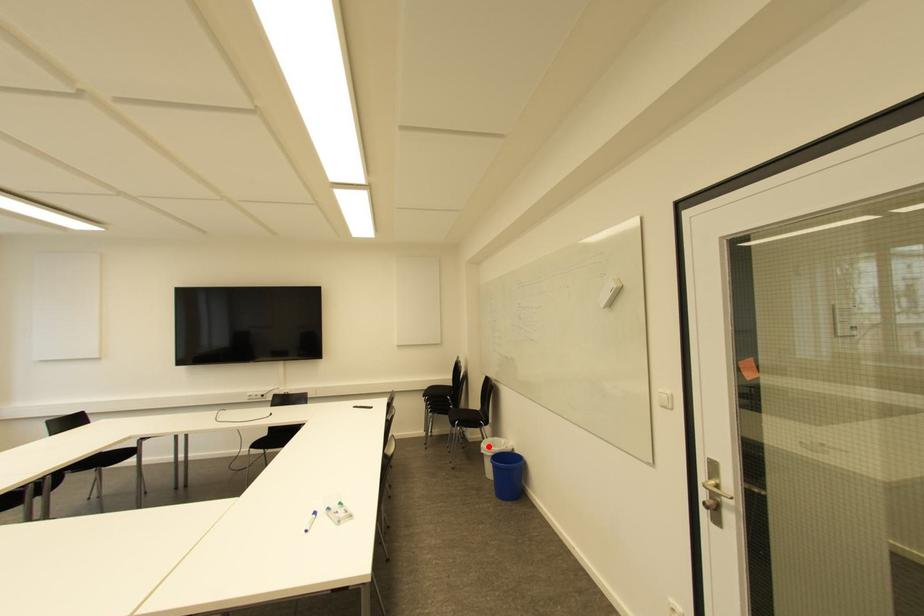
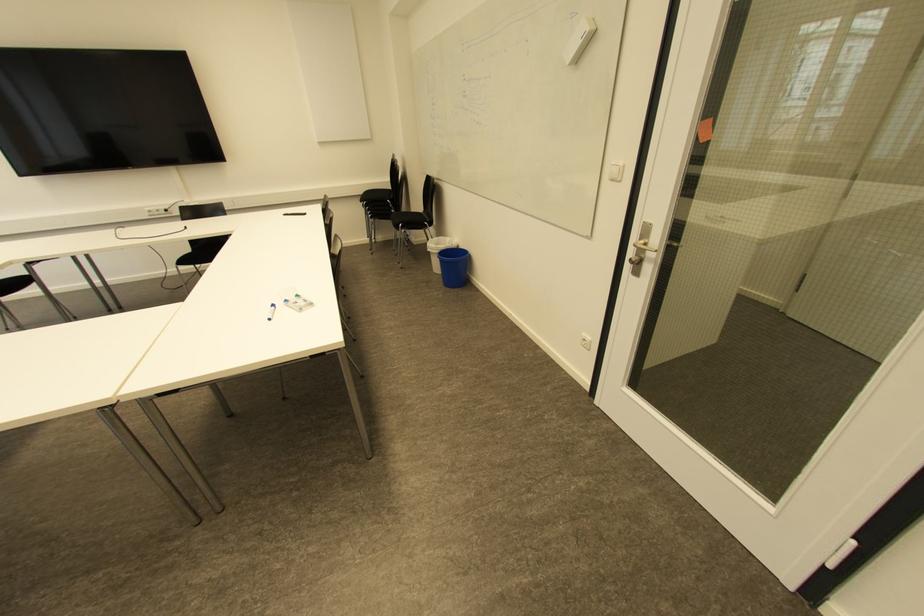
Question: A red point is marked in image1. In image2, is the corresponding 3D point closer to the camera or farther? Reply with the corresponding letter.

Choices:
 (A) The corresponding 3D point is closer.
 (B) The corresponding 3D point is farther.

Answer: (A)